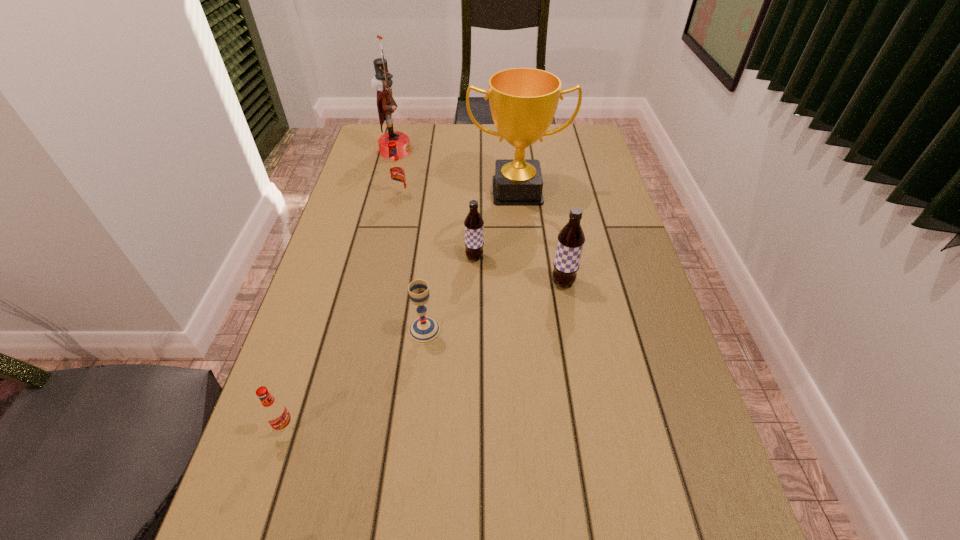
At what (x,y) coordinates should I click in order to perform the action: click on nutcracker. Please return your answer as a coordinate pair (x, y). The image size is (960, 540). Looking at the image, I should click on (382, 82).

Locate an element on the screen. The width and height of the screenshot is (960, 540). the farthest object is located at coordinates (382, 82).

The width and height of the screenshot is (960, 540). I want to click on award, so click(523, 101).

This screenshot has height=540, width=960. What are the coordinates of `the right brown root beer` in the screenshot? It's located at coord(571,239).

The height and width of the screenshot is (540, 960). I want to click on the fifth farthest object, so click(571, 239).

Where is `the bigger red root beer`? the bigger red root beer is located at coordinates (396, 174).

Where is `the farther red root beer`? This screenshot has height=540, width=960. the farther red root beer is located at coordinates pos(396,174).

Image resolution: width=960 pixels, height=540 pixels. In order to click on the farther brown root beer in this screenshot , I will do pos(473,224).

This screenshot has height=540, width=960. In order to click on the smaller brown root beer in this screenshot , I will do `click(473, 224)`.

Image resolution: width=960 pixels, height=540 pixels. Identify the location of the fourth object from right to left. (424, 330).